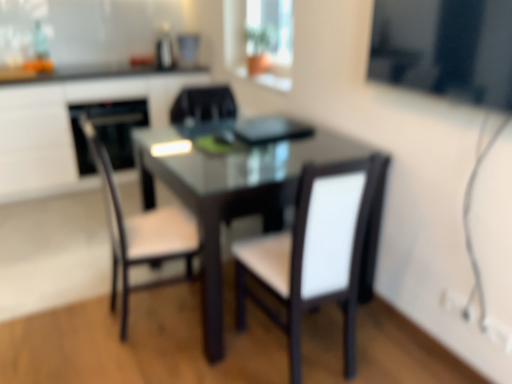
Image resolution: width=512 pixels, height=384 pixels. I want to click on vacant region below white matte chair at center, which is the 1th chair in left-to-right order (from a real-world perspective), so click(x=152, y=309).